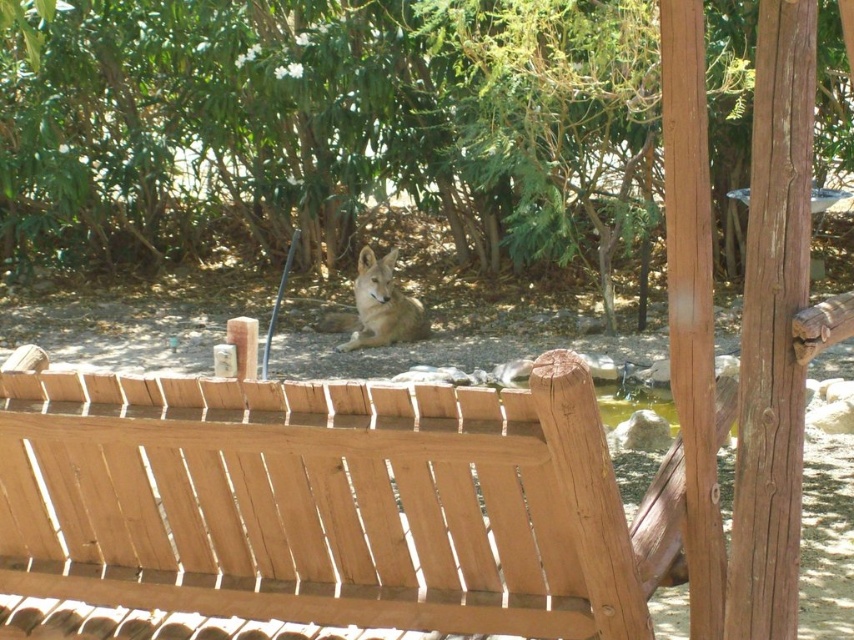
Question: Can you confirm if light brown wood bench at lower center is wider than fur-coated coyote at center?

Choices:
 (A) no
 (B) yes

Answer: (B)

Question: Is green leafy tree at center wider than light brown wood bench at lower center?

Choices:
 (A) yes
 (B) no

Answer: (A)

Question: Can you confirm if green leafy tree at center is smaller than fur-coated coyote at center?

Choices:
 (A) no
 (B) yes

Answer: (A)

Question: Which point appears farthest from the camera in this image?

Choices:
 (A) (355, 307)
 (B) (307, 499)

Answer: (A)

Question: Estimate the real-world distances between objects in this image. Which object is farther from the fur-coated coyote at center?

Choices:
 (A) light brown wood bench at lower center
 (B) green leafy tree at center

Answer: (A)

Question: Which point appears farthest from the camera in this image?

Choices:
 (A) (354, 572)
 (B) (375, 296)
 (C) (560, 51)

Answer: (B)